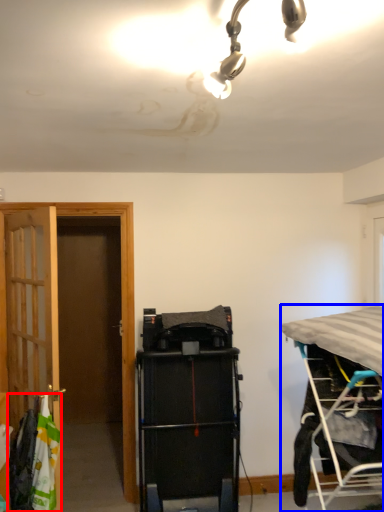
Question: Which point is further to the camera, laundry (highlighted by a red box) or bed (highlighted by a blue box)?

Choices:
 (A) laundry
 (B) bed

Answer: (A)